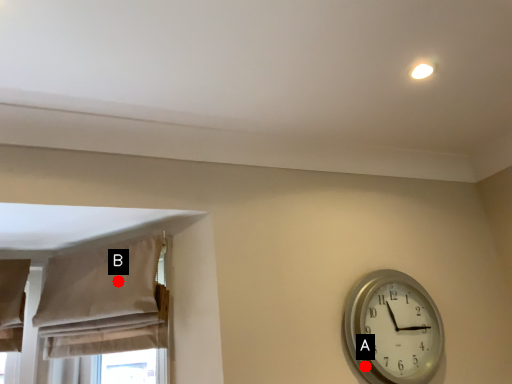
Question: Two points are circled on the image, labeled by A and B beside each circle. Which point appears farthest from the camera in this image?

Choices:
 (A) A is further
 (B) B is further

Answer: (B)